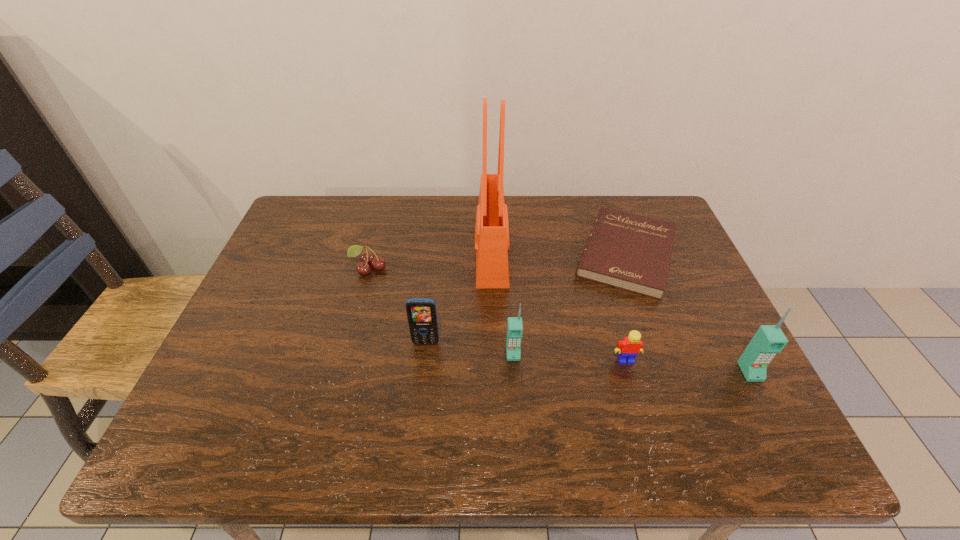
Given the evenly spaced cellular telephones in the image, where should an extra cellular telephone be added on the left to preserve the spacing? Please point to a vacant space. Please provide its 2D coordinates. Your answer should be formatted as a tuple, i.e. [(x, y)], where the tuple contains the x and y coordinates of a point satisfying the conditions above.

[(292, 336)]